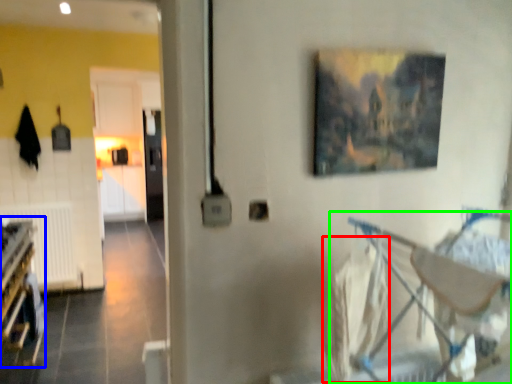
Question: Estimate the real-world distances between objects in this image. Which object is closer to laundry (highlighted by a red box), bunk bed (highlighted by a blue box) or baby carriage (highlighted by a green box)?

Choices:
 (A) bunk bed
 (B) baby carriage

Answer: (B)